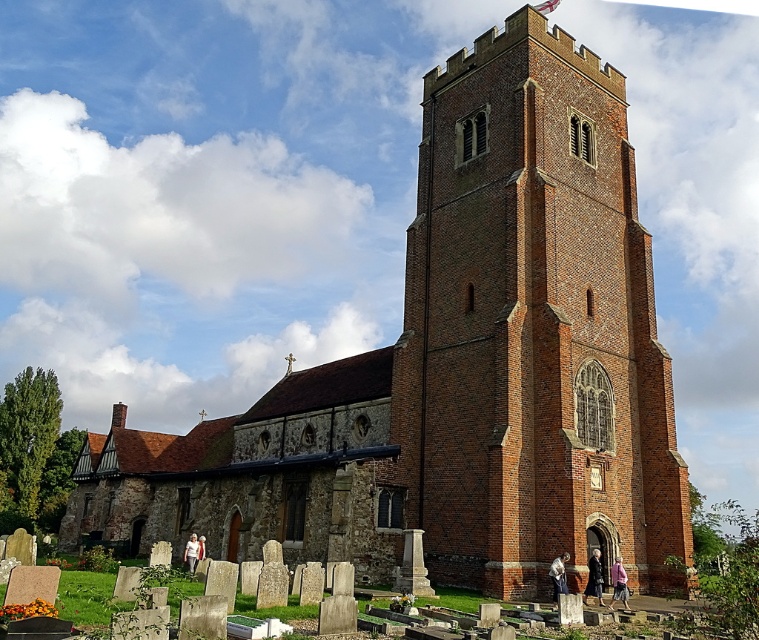
Can you confirm if brick tower at center is wider than pink fabric pants at lower right?

Yes.

Does brick tower at center have a lesser width compared to pink fabric pants at lower right?

No.

Identify the location of brick tower at center. Image resolution: width=759 pixels, height=640 pixels. (531, 326).

Who is shorter, dark gray wool coat at lower center or blue denim jeans at lower center?

Standing shorter between the two is dark gray wool coat at lower center.

Is point (597, 588) closer to camera compared to point (559, 593)?

No, it is behind (559, 593).

This screenshot has height=640, width=759. In order to click on dark gray wool coat at lower center in this screenshot , I will do `click(594, 577)`.

Does brick tower at center appear under dark gray wool coat at lower center?

Incorrect, brick tower at center is not positioned below dark gray wool coat at lower center.

Is point (537, 476) behind point (600, 570)?

Yes, it is.

Where is `brick tower at center`? The width and height of the screenshot is (759, 640). brick tower at center is located at coordinates (531, 326).

This screenshot has width=759, height=640. I want to click on brick tower at center, so click(x=531, y=326).